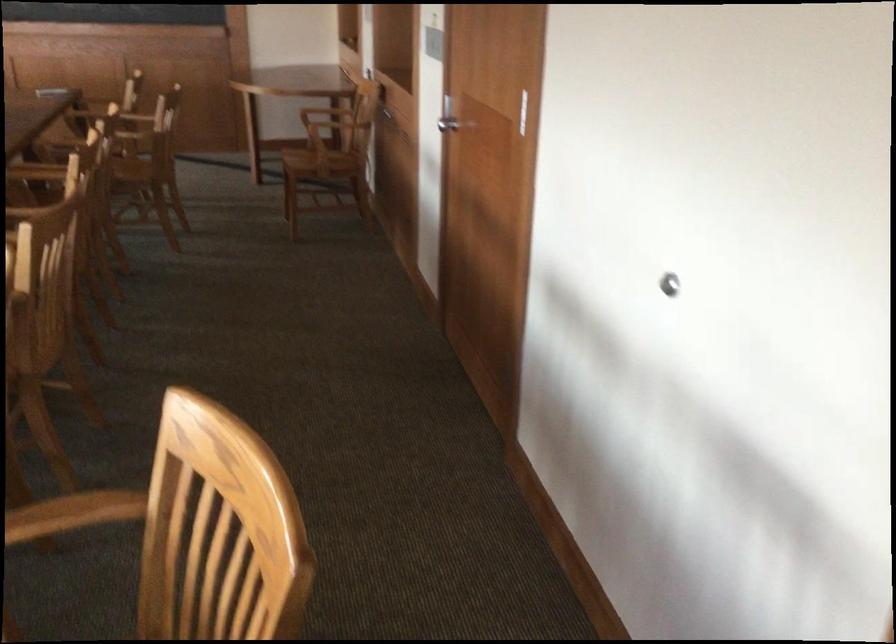
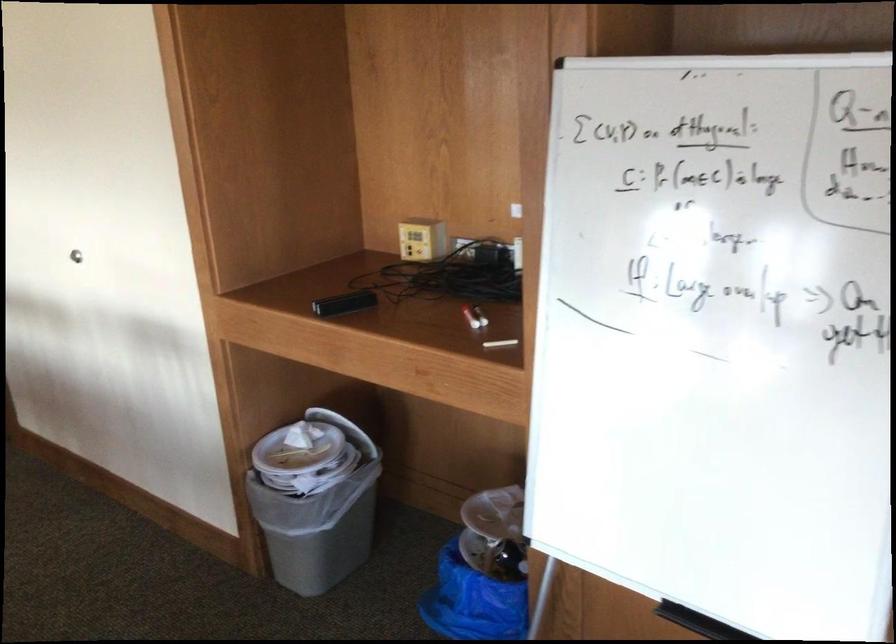
Locate, in the second image, the point that corresponds to the point at 673,287 in the first image.

(76, 254)